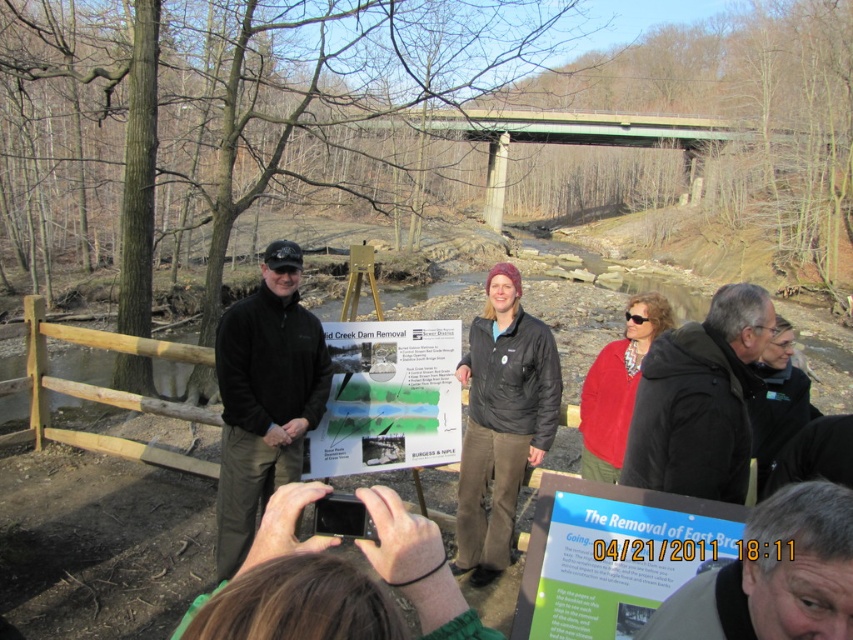
Question: Which of these objects is positioned farthest from the gray fabric jacket at center?

Choices:
 (A) blue glossy poster at center
 (B) matte paper poster at center

Answer: (B)

Question: Can you confirm if matte paper poster at center is positioned to the left of green concrete bridge at upper center?

Choices:
 (A) no
 (B) yes

Answer: (B)

Question: Which point is farther to the camera?

Choices:
 (A) black softshell jacket at center
 (B) blue glossy poster at center

Answer: (A)

Question: Among these objects, which one is farthest from the camera?

Choices:
 (A) matte paper poster at center
 (B) black jacket at center
 (C) black softshell jacket at center
 (D) blue glossy poster at center

Answer: (C)

Question: Is gray fabric jacket at center smaller than green concrete bridge at upper center?

Choices:
 (A) yes
 (B) no

Answer: (A)

Question: Is black jacket at center to the left of gray fabric jacket at center from the viewer's perspective?

Choices:
 (A) no
 (B) yes

Answer: (A)